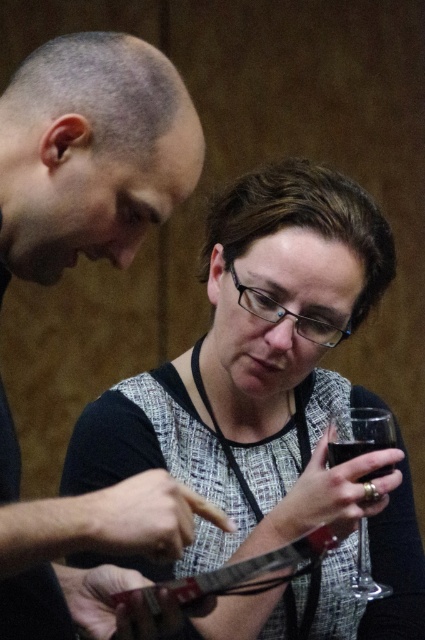
Question: Which point appears closest to the camera in this image?

Choices:
 (A) (331, 464)
 (B) (227, 324)
 (C) (118, 522)

Answer: (C)

Question: Can you confirm if speckled fabric dress at center is positioned below transparent glass at lower center?

Choices:
 (A) yes
 (B) no

Answer: (B)

Question: Does speckled fabric dress at center come in front of clear glass at lower center?

Choices:
 (A) no
 (B) yes

Answer: (B)

Question: Estimate the real-world distances between objects in this image. Which object is farther from the matte black shirt at left?

Choices:
 (A) clear glass at lower center
 (B) transparent glass at lower center

Answer: (A)

Question: Is matte black shirt at left closer to the viewer compared to transparent glass at lower center?

Choices:
 (A) no
 (B) yes

Answer: (B)

Question: Which of these objects is positioned farthest from the speckled fabric dress at center?

Choices:
 (A) matte black shirt at left
 (B) transparent glass at lower center
 (C) clear glass at lower center

Answer: (A)